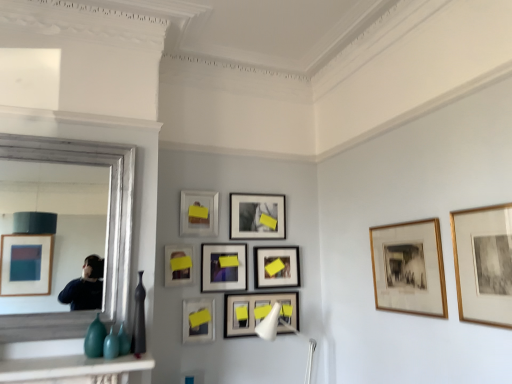
Measure the distance between point (77, 239) and camera.

The distance of point (77, 239) from camera is 14.21 feet.

Image resolution: width=512 pixels, height=384 pixels. What do you see at coordinates (198, 320) in the screenshot?
I see `matte black picture frame at center, which ranks as the third picture frame in front-to-back order` at bounding box center [198, 320].

Find the location of a particular element. The width and height of the screenshot is (512, 384). matte black picture frame at center, which ranks as the third picture frame in front-to-back order is located at coordinates (198, 320).

Find the location of a particular element. This screenshot has width=512, height=384. gold-framed print at right, the 1th picture frame from the front is located at coordinates (483, 264).

The image size is (512, 384). Identify the location of matte glass picture frame at center, which is the fourth picture frame from front to back. (178, 266).

Locate an element on the screen. Image resolution: width=512 pixels, height=384 pixels. marble white mantelpiece at lower left is located at coordinates (77, 370).

Is point (234, 277) less distant than point (143, 288)?

No, it is behind (143, 288).

Based on the photo, does matte black picture frame at center, acting as the 7th picture frame starting from the front, have a lesser width compared to matte black vase at left?

Correct, the width of matte black picture frame at center, acting as the 7th picture frame starting from the front, is less than that of matte black vase at left.

Do you think matte black picture frame at center, the 3th picture frame positioned from the back, is within matte black vase at left, or outside of it?

matte black picture frame at center, the 3th picture frame positioned from the back, lies outside matte black vase at left.

The image size is (512, 384). In order to click on picture frame that is the 4th one when counting rightward from the matte black vase at left in this screenshot , I will do (223, 267).

Who is taller, gold-framed print at center-right, marked as the 8th picture frame in a back-to-front arrangement, or matte black vase at left?

With more height is gold-framed print at center-right, marked as the 8th picture frame in a back-to-front arrangement.

Between gold-framed print at center-right, marked as the 8th picture frame in a back-to-front arrangement, and matte black vase at left, which one has larger width?

With larger width is matte black vase at left.

From the image's perspective, which one is positioned higher, gold-framed print at center-right, acting as the 2th picture frame starting from the front, or matte black vase at left?

gold-framed print at center-right, acting as the 2th picture frame starting from the front.

Does gold-framed print at center-right, marked as the 8th picture frame in a back-to-front arrangement, turn towards matte black vase at left?

Yes, gold-framed print at center-right, marked as the 8th picture frame in a back-to-front arrangement, is facing matte black vase at left.

Is matte black picture frame at center, which is the eighth picture frame from front to back, located within matte glass picture frame at center, marked as the sixth picture frame in a back-to-front arrangement?

No.

Is matte glass picture frame at center, marked as the sixth picture frame in a back-to-front arrangement, turned away from matte black picture frame at center, which is the eighth picture frame from front to back?

No, matte black picture frame at center, which is the eighth picture frame from front to back, is not at the back of matte glass picture frame at center, marked as the sixth picture frame in a back-to-front arrangement.

Considering the positions of objects matte glass picture frame at center, which is the fourth picture frame from front to back, and matte black picture frame at center, positioned as the 2th picture frame in back-to-front order, in the image provided, who is more to the right, matte glass picture frame at center, which is the fourth picture frame from front to back, or matte black picture frame at center, positioned as the 2th picture frame in back-to-front order,?

Positioned to the right is matte black picture frame at center, positioned as the 2th picture frame in back-to-front order.

From a real-world perspective, does matte glass picture frame at center, marked as the sixth picture frame in a back-to-front arrangement, stand above matte black picture frame at center, positioned as the 2th picture frame in back-to-front order?

No.

Which of these two, matte black picture frame at center, positioned as the 1th picture frame in back-to-front order, or matte glass picture frame at center, which is the fourth picture frame from front to back, stands taller?

With more height is matte black picture frame at center, positioned as the 1th picture frame in back-to-front order.

Between matte black picture frame at center, positioned as the 1th picture frame in back-to-front order, and matte glass picture frame at center, marked as the sixth picture frame in a back-to-front arrangement, which one has smaller size?

matte glass picture frame at center, marked as the sixth picture frame in a back-to-front arrangement, is smaller.

From a real-world perspective, is matte black picture frame at center, positioned as the 1th picture frame in back-to-front order, above or below matte glass picture frame at center, which is the fourth picture frame from front to back?

In terms of real-world spatial position, matte black picture frame at center, positioned as the 1th picture frame in back-to-front order, is below matte glass picture frame at center, which is the fourth picture frame from front to back.

Which picture frame is the 6th one when counting from the left side of the matte black picture frame at center, the ninth picture frame when ordered from front to back? Please provide its 2D coordinates.

[(178, 266)]

From the picture: Is the depth of white plastic lamp at center less than that of silver framed mirror at left?

No.

What's the angular difference between white plastic lamp at center and silver framed mirror at left's facing directions?

The angular difference between white plastic lamp at center and silver framed mirror at left is 0.643 degrees.

Between white plastic lamp at center and silver framed mirror at left, which one has larger size?

white plastic lamp at center is bigger.

Which object is positioned more to the right, white plastic lamp at center or silver framed mirror at left?

Positioned to the right is white plastic lamp at center.

Considering the points (207, 338) and (63, 222), which point is behind, point (207, 338) or point (63, 222)?

The point (63, 222) is more distant.

In the scene shown: Do you think matte black picture frame at center, the seventh picture frame from the back, is within silver framed mirror at left, or outside of it?

matte black picture frame at center, the seventh picture frame from the back, is not enclosed by silver framed mirror at left.

Is matte black picture frame at center, which ranks as the third picture frame in front-to-back order, turned away from silver framed mirror at left?

matte black picture frame at center, which ranks as the third picture frame in front-to-back order, is not turned away from silver framed mirror at left.

From the picture: Is matte black picture frame at center, the seventh picture frame from the back, taller than marble white mantelpiece at lower left?

Yes, matte black picture frame at center, the seventh picture frame from the back, is taller than marble white mantelpiece at lower left.

Between matte black picture frame at center, which ranks as the third picture frame in front-to-back order, and marble white mantelpiece at lower left, which one appears on the right side from the viewer's perspective?

matte black picture frame at center, which ranks as the third picture frame in front-to-back order, is more to the right.

Does matte black picture frame at center, the seventh picture frame from the back, turn towards marble white mantelpiece at lower left?

No, matte black picture frame at center, the seventh picture frame from the back, is not aimed at marble white mantelpiece at lower left.

Where is `the 3rd picture frame above the matte black vase at left (from a real-world perspective)`? The image size is (512, 384). the 3rd picture frame above the matte black vase at left (from a real-world perspective) is located at coordinates (223, 267).

The width and height of the screenshot is (512, 384). In the image, there is a gold-framed print at center-right, marked as the 8th picture frame in a back-to-front arrangement. Find the location of `vase below it (from a real-world perspective)`. vase below it (from a real-world perspective) is located at coordinates (139, 320).

Consider the image. When comparing their distances from matte white picture frame at center, which appears as the fifth picture frame when viewed from the front, does gold-framed print at center-right, marked as the 8th picture frame in a back-to-front arrangement, or matte black picture frame at center, the 3th picture frame positioned from the back, seem further?

gold-framed print at center-right, marked as the 8th picture frame in a back-to-front arrangement, lies further to matte white picture frame at center, which appears as the fifth picture frame when viewed from the front, than the other object.

Considering their positions, is matte black vase at left positioned closer to matte black picture frame at center, positioned as the 1th picture frame in back-to-front order, than silver framed mirror at left?

matte black vase at left is closer to matte black picture frame at center, positioned as the 1th picture frame in back-to-front order.

Estimate the real-world distances between objects in this image. Which object is closer to silver framed mirror at left, matte glass picture frame at center, marked as the sixth picture frame in a back-to-front arrangement, or matte white picture frame at center, which is the 5th picture frame in back-to-front order?

matte white picture frame at center, which is the 5th picture frame in back-to-front order, lies closer to silver framed mirror at left than the other object.

Looking at the image, which one is located closer to matte glass picture frame at center, marked as the sixth picture frame in a back-to-front arrangement, marble white mantelpiece at lower left or matte black picture frame at lower center, which ranks as the 4th picture frame in back-to-front order?

Among the two, matte black picture frame at lower center, which ranks as the 4th picture frame in back-to-front order, is located nearer to matte glass picture frame at center, marked as the sixth picture frame in a back-to-front arrangement.

Considering their positions, is matte glass picture frame at center, marked as the sixth picture frame in a back-to-front arrangement, positioned further to matte black picture frame at center, which ranks as the third picture frame in front-to-back order, than gold-framed print at center-right, marked as the 8th picture frame in a back-to-front arrangement?

Among the two, gold-framed print at center-right, marked as the 8th picture frame in a back-to-front arrangement, is located further to matte black picture frame at center, which ranks as the third picture frame in front-to-back order.

Looking at the image, which one is located closer to matte black picture frame at lower center, placed as the 6th picture frame when sorted from front to back, marble white mantelpiece at lower left or silver framed mirror at left?

marble white mantelpiece at lower left is closer to matte black picture frame at lower center, placed as the 6th picture frame when sorted from front to back.

When comparing their distances from gold-framed print at center-right, acting as the 2th picture frame starting from the front, does silver framed mirror at left or matte white picture frame at center, which appears as the fifth picture frame when viewed from the front, seem further?

silver framed mirror at left lies further to gold-framed print at center-right, acting as the 2th picture frame starting from the front, than the other object.

Looking at the image, which one is located closer to matte white picture frame at center, which is the 5th picture frame in back-to-front order, matte black picture frame at lower center, which ranks as the 4th picture frame in back-to-front order, or teal glass vase at lower left?

matte black picture frame at lower center, which ranks as the 4th picture frame in back-to-front order.

You are a GUI agent. You are given a task and a screenshot of the screen. Output one action in this format:
    pyautogui.click(x=<x>, y=<y>)
    Task: Click on the light fixture situated between marble white mantelpiece at lower left and gold-framed print at right, the 1th picture frame from the front, from left to right
    The height and width of the screenshot is (384, 512).
    Given the screenshot: What is the action you would take?
    pyautogui.click(x=289, y=330)

At what (x,y) coordinates should I click in order to perform the action: click on glass vase between marble white mantelpiece at lower left and matte black picture frame at lower center, placed as the 6th picture frame when sorted from front to back, along the z-axis. Please return your answer as a coordinate pair (x, y). Looking at the image, I should click on click(95, 339).

At what (x,y) coordinates should I click in order to perform the action: click on mirror between marble white mantelpiece at lower left and matte black picture frame at center, the seventh picture frame from the back, along the z-axis. Please return your answer as a coordinate pair (x, y). The width and height of the screenshot is (512, 384). Looking at the image, I should click on (57, 219).

Locate an element on the screen. The image size is (512, 384). light fixture between matte black vase at left and gold-framed print at right, the 1th picture frame from the front, from left to right is located at coordinates (289, 330).